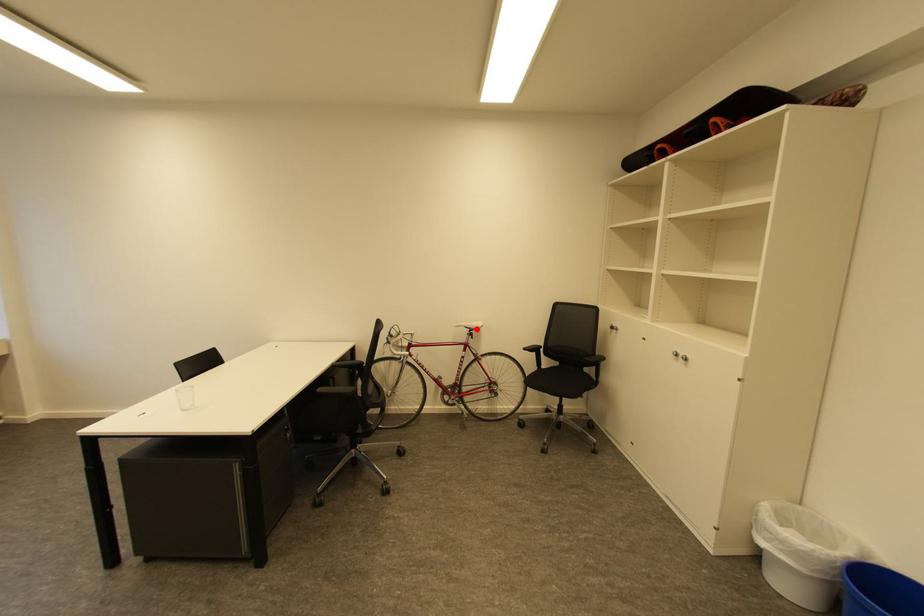
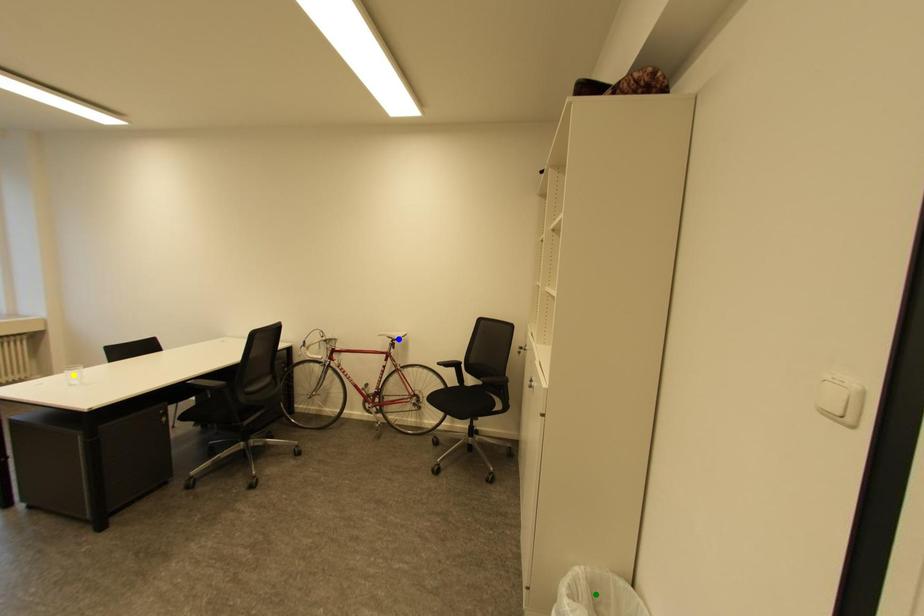
Question: I am providing you with two images of the same scene from different viewpoints. A red point is marked on the first image. You are given multiple points on the second image. Which mark in image 2 goes with the point in image 1?

Choices:
 (A) green point
 (B) blue point
 (C) yellow point

Answer: (B)